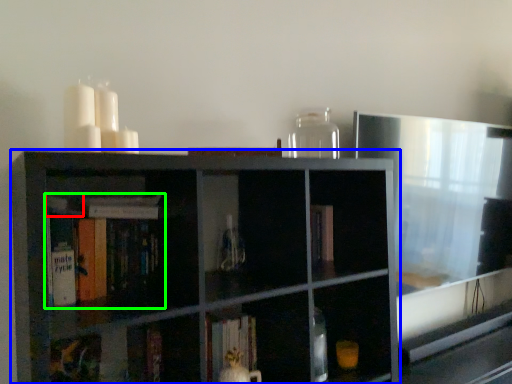
Question: Based on their relative distances, which object is farther from book (highlighted by a red box)? Choose from shelf (highlighted by a blue box) and book (highlighted by a green box).

Choices:
 (A) shelf
 (B) book

Answer: (A)